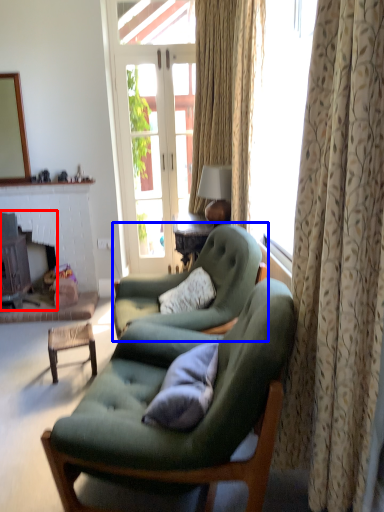
Question: Among these objects, which one is farthest to the camera, fireplace (highlighted by a red box) or chair (highlighted by a blue box)?

Choices:
 (A) fireplace
 (B) chair

Answer: (A)